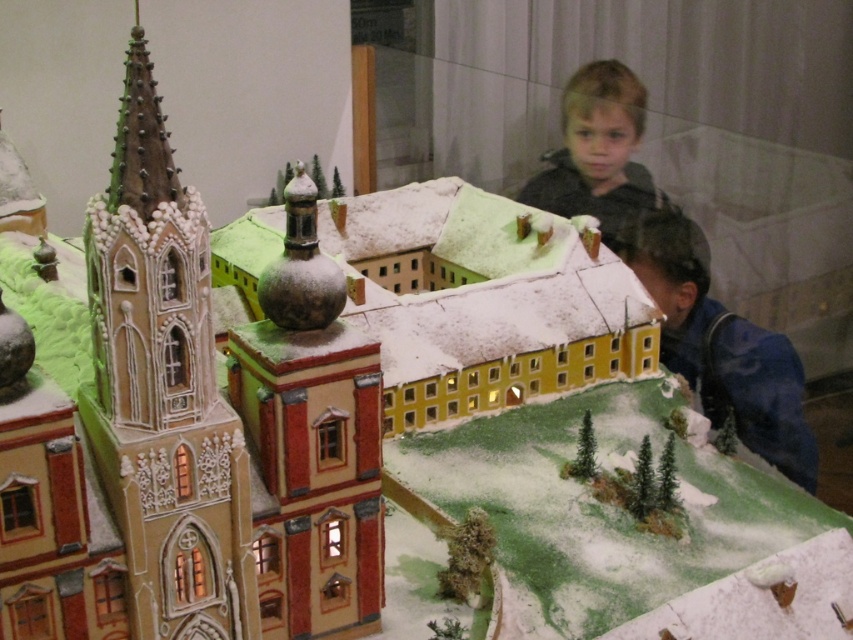
Question: Which point is farther to the camera?

Choices:
 (A) (683, 300)
 (B) (538, 184)

Answer: (B)

Question: Does blue fabric jacket at lower right have a larger size compared to blonde hair boy at upper right?

Choices:
 (A) no
 (B) yes

Answer: (B)

Question: In this image, where is blue fabric jacket at lower right located relative to blonde hair boy at upper right?

Choices:
 (A) below
 (B) above

Answer: (A)

Question: Is blue fabric jacket at lower right closer to the viewer compared to blonde hair boy at upper right?

Choices:
 (A) yes
 (B) no

Answer: (A)

Question: Which point is farther to the camera?

Choices:
 (A) (677, 276)
 (B) (570, 88)

Answer: (B)